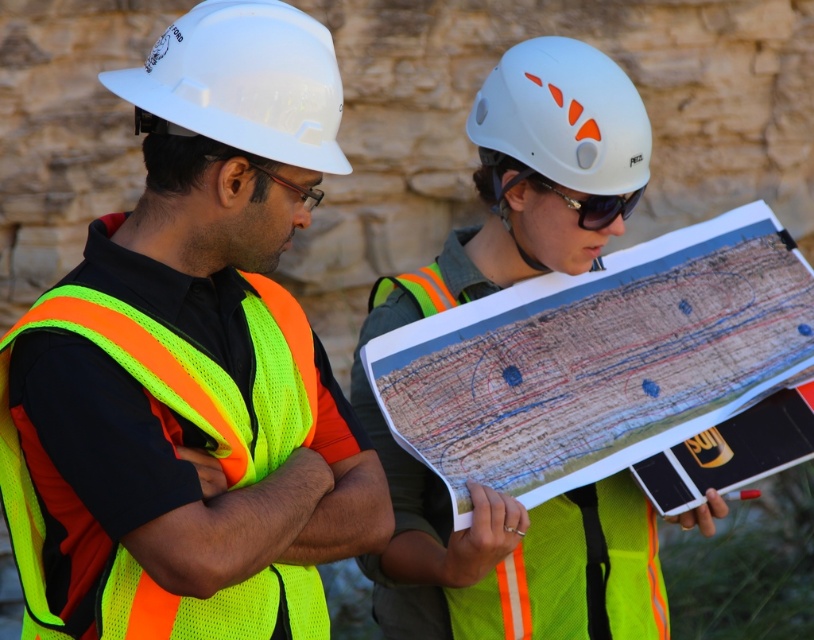
Looking at this image, between white matte helmet at upper center and sunglasses at center, which one appears on the right side from the viewer's perspective?

From the viewer's perspective, sunglasses at center appears more on the right side.

Does white matte helmet at upper center lie in front of sunglasses at center?

Yes, white matte helmet at upper center is in front of sunglasses at center.

The height and width of the screenshot is (640, 814). Identify the location of white matte helmet at upper center. (563, 116).

Locate an element on the screen. This screenshot has height=640, width=814. white matte helmet at upper center is located at coordinates (563, 116).

Who is positioned more to the right, neon yellow mesh safety vest at left or sunglasses at center?

From the viewer's perspective, sunglasses at center appears more on the right side.

Can you confirm if neon yellow mesh safety vest at left is smaller than sunglasses at center?

Yes.

Based on the photo, measure the distance between neon yellow mesh safety vest at left and camera.

A distance of 29.55 meters exists between neon yellow mesh safety vest at left and camera.

The width and height of the screenshot is (814, 640). Find the location of `neon yellow mesh safety vest at left`. neon yellow mesh safety vest at left is located at coordinates (173, 444).

Consider the image. Can you confirm if neon yellow reflective vest at center is positioned to the right of sunglasses at center?

Incorrect, neon yellow reflective vest at center is not on the right side of sunglasses at center.

Who is higher up, neon yellow reflective vest at center or sunglasses at center?

Positioned higher is sunglasses at center.

Locate an element on the screen. This screenshot has height=640, width=814. neon yellow reflective vest at center is located at coordinates (484, 294).